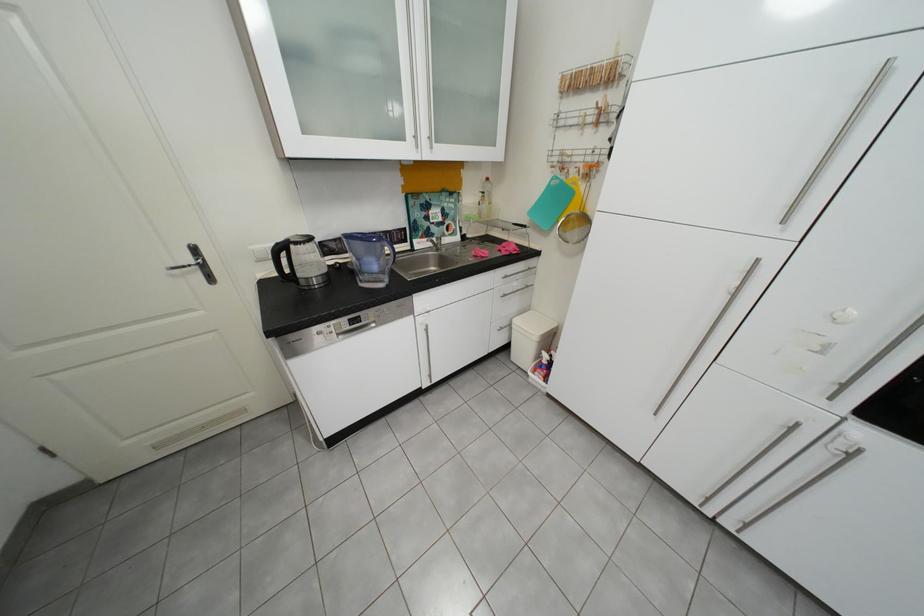
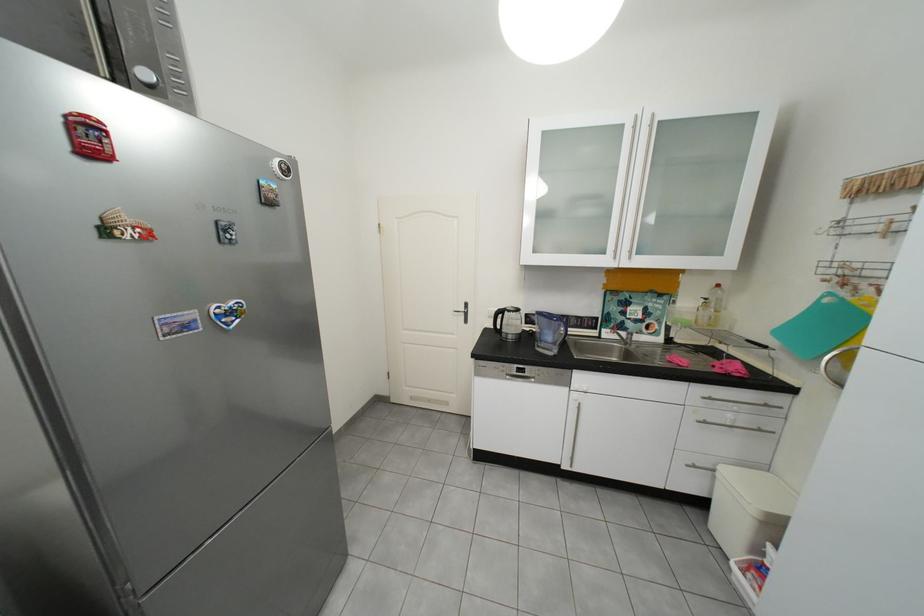
Find the pixel in the second image that matches point 295,248 in the first image.

(513, 313)